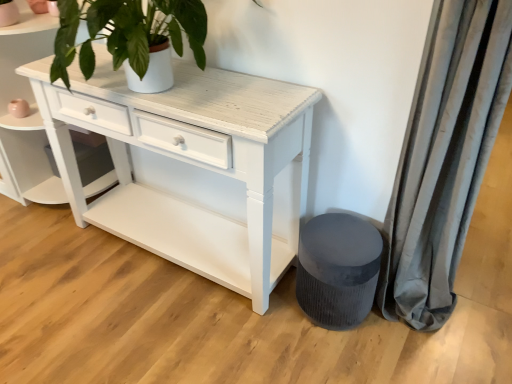
Question: Should I look upward or downward to see white distressed wood shelf at center?

Choices:
 (A) down
 (B) up

Answer: (B)

Question: Is velvet grey stool at lower right to the right of white distressed wood shelf at center from the viewer's perspective?

Choices:
 (A) no
 (B) yes

Answer: (B)

Question: Can you confirm if velvet grey stool at lower right is shorter than white distressed wood shelf at center?

Choices:
 (A) no
 (B) yes

Answer: (B)

Question: Does velvet grey stool at lower right have a lesser width compared to white distressed wood shelf at center?

Choices:
 (A) no
 (B) yes

Answer: (B)

Question: From a real-world perspective, is velvet grey stool at lower right on white distressed wood shelf at center?

Choices:
 (A) no
 (B) yes

Answer: (A)

Question: From the image's perspective, is velvet grey stool at lower right below white distressed wood shelf at center?

Choices:
 (A) no
 (B) yes

Answer: (B)

Question: Is velvet grey stool at lower right completely or partially outside of white distressed wood shelf at center?

Choices:
 (A) no
 (B) yes

Answer: (B)

Question: Is white distressed wood shelf at center next to velvet grey stool at lower right?

Choices:
 (A) yes
 (B) no

Answer: (B)

Question: Does white distressed wood shelf at center lie behind velvet grey stool at lower right?

Choices:
 (A) yes
 (B) no

Answer: (A)

Question: Considering the relative positions of white distressed wood shelf at center and velvet grey stool at lower right in the image provided, is white distressed wood shelf at center to the right of velvet grey stool at lower right from the viewer's perspective?

Choices:
 (A) no
 (B) yes

Answer: (A)

Question: Considering the relative sizes of white distressed wood shelf at center and velvet grey stool at lower right in the image provided, is white distressed wood shelf at center thinner than velvet grey stool at lower right?

Choices:
 (A) no
 (B) yes

Answer: (A)

Question: Is white distressed wood shelf at center oriented away from velvet grey stool at lower right?

Choices:
 (A) no
 (B) yes

Answer: (A)

Question: From a real-world perspective, does white distressed wood shelf at center stand above velvet grey stool at lower right?

Choices:
 (A) yes
 (B) no

Answer: (A)

Question: From a real-world perspective, is white distressed wood shelf at center on top of gray velvet curtain at right?

Choices:
 (A) yes
 (B) no

Answer: (B)